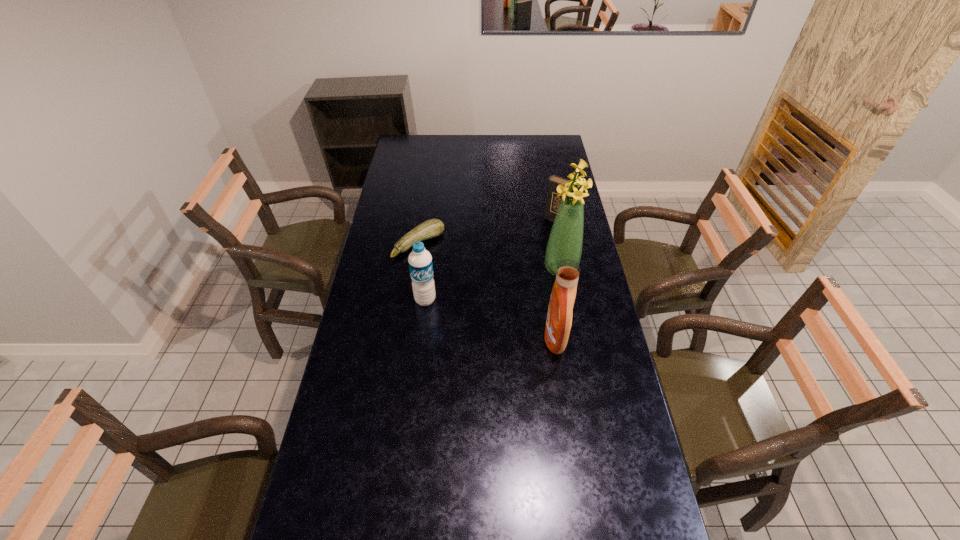
The width and height of the screenshot is (960, 540). In order to click on object present at the left edge in this screenshot , I will do `click(431, 228)`.

The width and height of the screenshot is (960, 540). I want to click on detergent that is at the right edge, so click(559, 317).

Find the location of a particular element. bouquet that is at the right edge is located at coordinates (565, 241).

Locate an element on the screen. This screenshot has height=540, width=960. diary positioned at the right edge is located at coordinates (552, 203).

Image resolution: width=960 pixels, height=540 pixels. In the image, there is a desktop. Identify the location of vacant space at the far edge. (503, 140).

Where is `free space at the left edge of the desktop`? free space at the left edge of the desktop is located at coordinates (344, 383).

Where is `vacant region at the right edge of the desktop`? This screenshot has height=540, width=960. vacant region at the right edge of the desktop is located at coordinates (588, 368).

Where is `vacant space at the far left corner of the desktop`? vacant space at the far left corner of the desktop is located at coordinates (406, 137).

In order to click on free space at the near left corner of the desktop in this screenshot , I will do `click(349, 503)`.

Locate an element on the screen. The width and height of the screenshot is (960, 540). vacant area that lies between the zucchini and the bouquet is located at coordinates click(x=490, y=256).